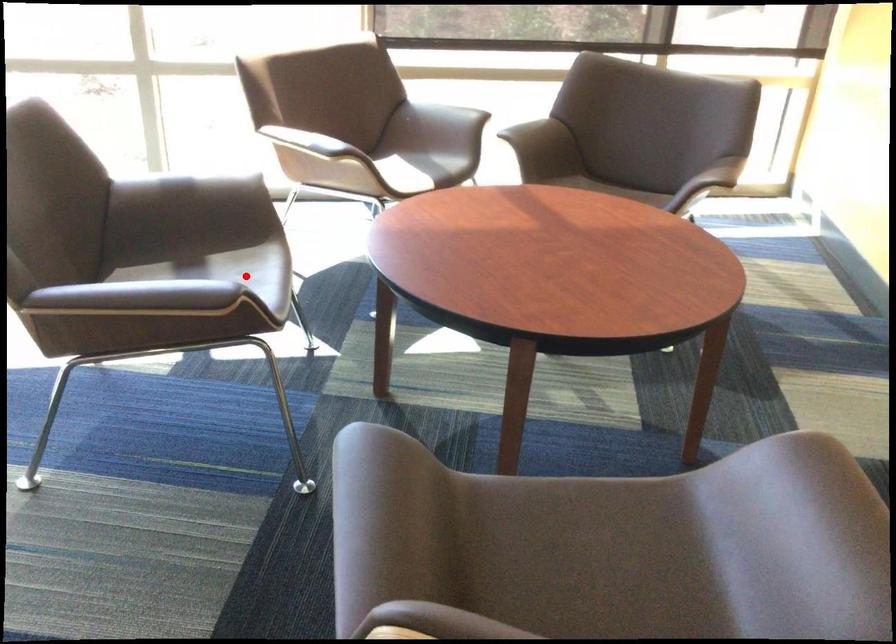
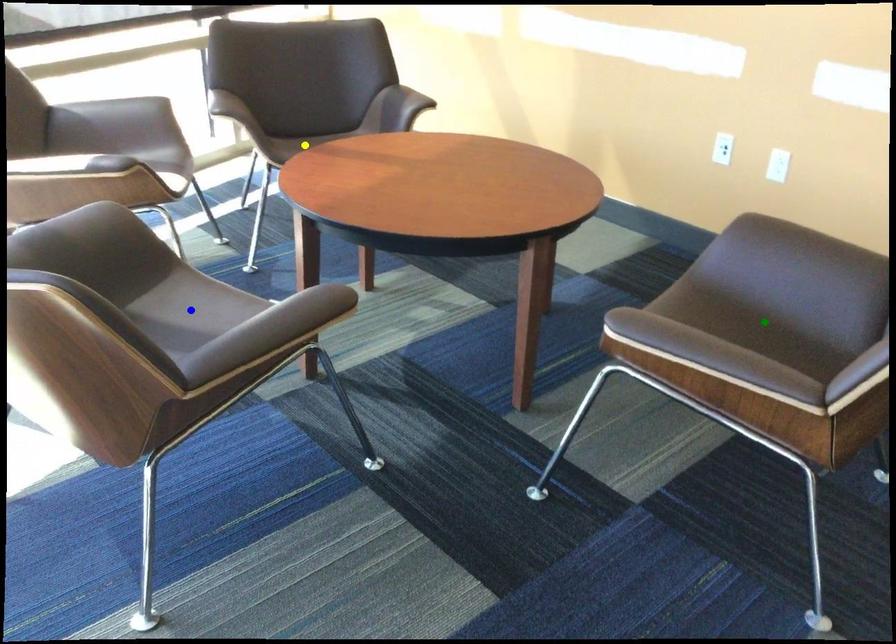
Question: I am providing you with two images of the same scene from different viewpoints. A red point is marked on the first image. You are given multiple points on the second image. Can you choose the point in image 2 that corresponds to the point in image 1?

Choices:
 (A) blue point
 (B) green point
 (C) yellow point

Answer: (A)